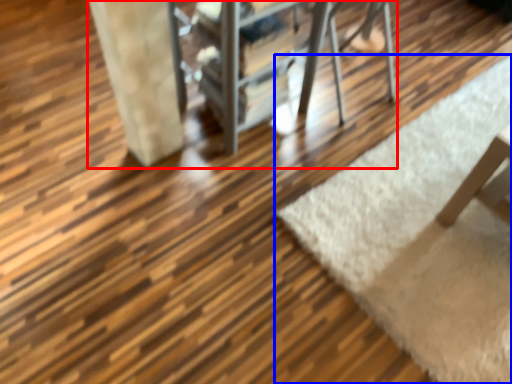
Question: Which object appears farthest to the camera in this image, furniture (highlighted by a red box) or mat (highlighted by a blue box)?

Choices:
 (A) furniture
 (B) mat

Answer: (B)